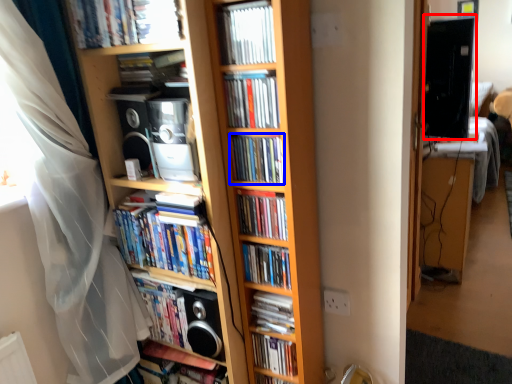
Question: Among these objects, which one is farthest to the camera, computer monitor (highlighted by a red box) or book (highlighted by a blue box)?

Choices:
 (A) computer monitor
 (B) book

Answer: (A)